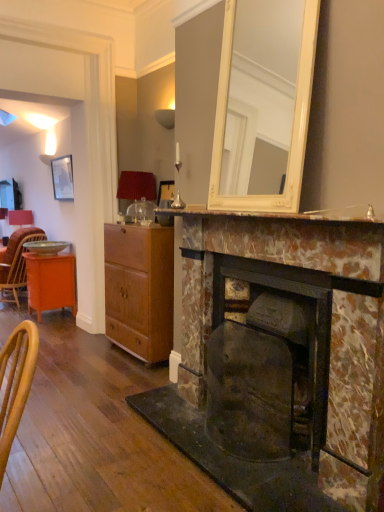
Question: From a real-world perspective, is metallic silver plate at left positioned over wooden cabinet at center based on gravity?

Choices:
 (A) yes
 (B) no

Answer: (A)

Question: Is wooden cabinet at center located within metallic silver plate at left?

Choices:
 (A) no
 (B) yes

Answer: (A)

Question: Is metallic silver plate at left positioned with its back to wooden cabinet at center?

Choices:
 (A) no
 (B) yes

Answer: (A)

Question: Does metallic silver plate at left lie behind wooden cabinet at center?

Choices:
 (A) yes
 (B) no

Answer: (A)

Question: Does metallic silver plate at left appear on the right side of wooden cabinet at center?

Choices:
 (A) yes
 (B) no

Answer: (B)

Question: From a real-world perspective, is metallic silver plate at left positioned under wooden cabinet at center based on gravity?

Choices:
 (A) no
 (B) yes

Answer: (A)

Question: Is wooden wicker chair at left looking in the opposite direction of marble fireplace at center, the 1th fireplace in the front-to-back sequence?

Choices:
 (A) no
 (B) yes

Answer: (A)

Question: Can you confirm if wooden wicker chair at left is wider than marble fireplace at center, the 1th fireplace in the front-to-back sequence?

Choices:
 (A) no
 (B) yes

Answer: (B)

Question: Does wooden wicker chair at left have a lesser width compared to marble fireplace at center, the 1th fireplace in the front-to-back sequence?

Choices:
 (A) no
 (B) yes

Answer: (A)

Question: Is wooden wicker chair at left outside marble fireplace at center, the 1th fireplace in the front-to-back sequence?

Choices:
 (A) yes
 (B) no

Answer: (A)

Question: Is wooden wicker chair at left to the left of marble fireplace at center, placed as the 2th fireplace when sorted from back to front, from the viewer's perspective?

Choices:
 (A) yes
 (B) no

Answer: (A)

Question: Does wooden wicker chair at left have a greater height compared to marble fireplace at center, placed as the 2th fireplace when sorted from back to front?

Choices:
 (A) yes
 (B) no

Answer: (B)

Question: From the image's perspective, is orange wood desk at left on top of matte black picture frame at upper left?

Choices:
 (A) no
 (B) yes

Answer: (A)